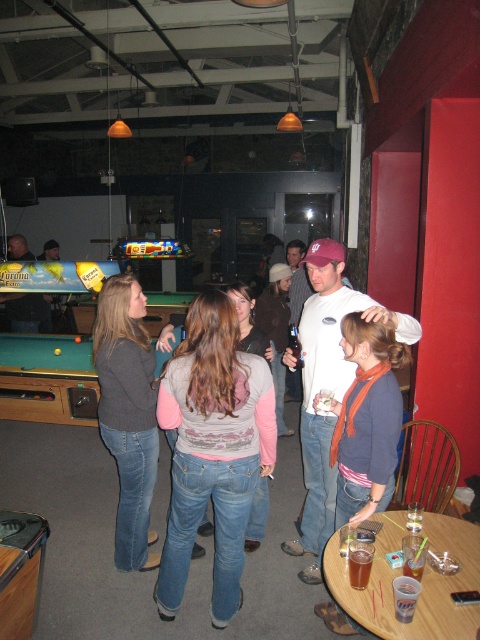
You are standing at the entrance of the bar and see both the green felt pool table at lower left and the matte black pool table at left. Which pool table is positioned more to your right side?

The green felt pool table at lower left is positioned more to your right side because it is located to the right of the matte black pool table at left.

You are a bartender who needs to deliver a drink to the translucent plastic cup at center. The shortest path from the bar to the cup requires passing by the green felt pool table at left. If your speed is 1 meter per second, how many seconds will it take to reach the cup?

Result: The distance between the green felt pool table at left and the translucent plastic cup at center is 6.33 meters. Since the shortest path requires passing by the pool table, the total distance would be 6.33 meters. At 1 meter per second, it would take 6.33 seconds to reach the cup.

You are a bartender who needs to place a new drink order. You see the green felt pool table at left and the translucent plastic cup at center. Which object is higher in height?

The green felt pool table at left is taller than the translucent plastic cup at center.